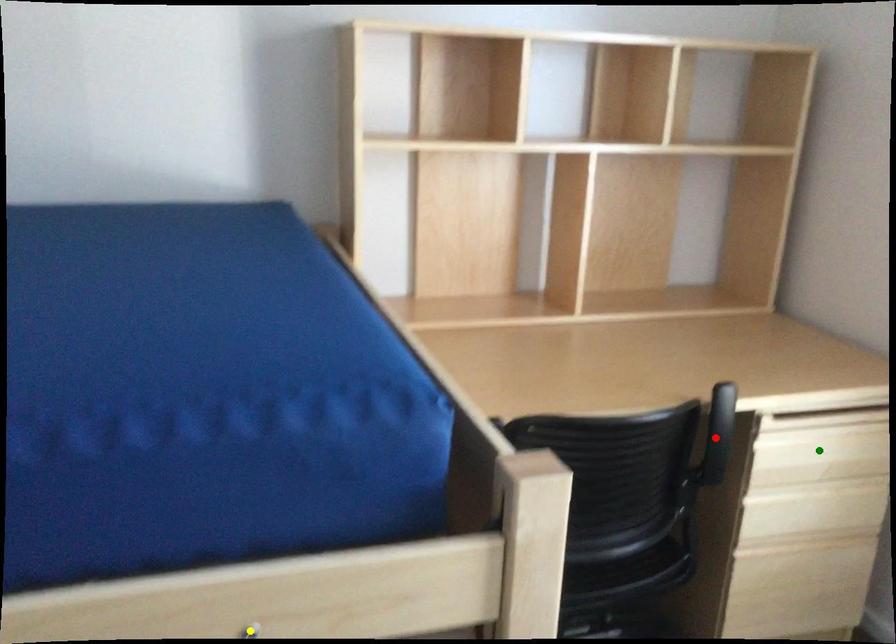
In the scene shown: Order these from nearest to farthest:
red point, green point, yellow point

1. yellow point
2. green point
3. red point